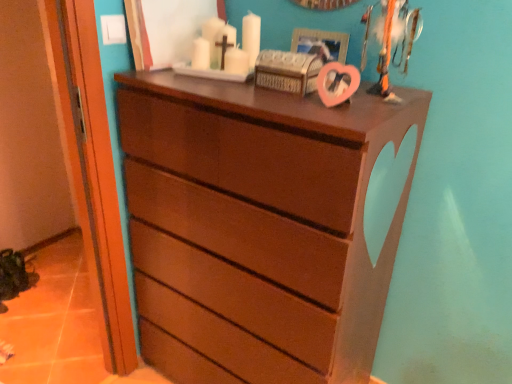
Find the location of a particular element. free space in front of metallic silver trophy at upper right is located at coordinates (370, 105).